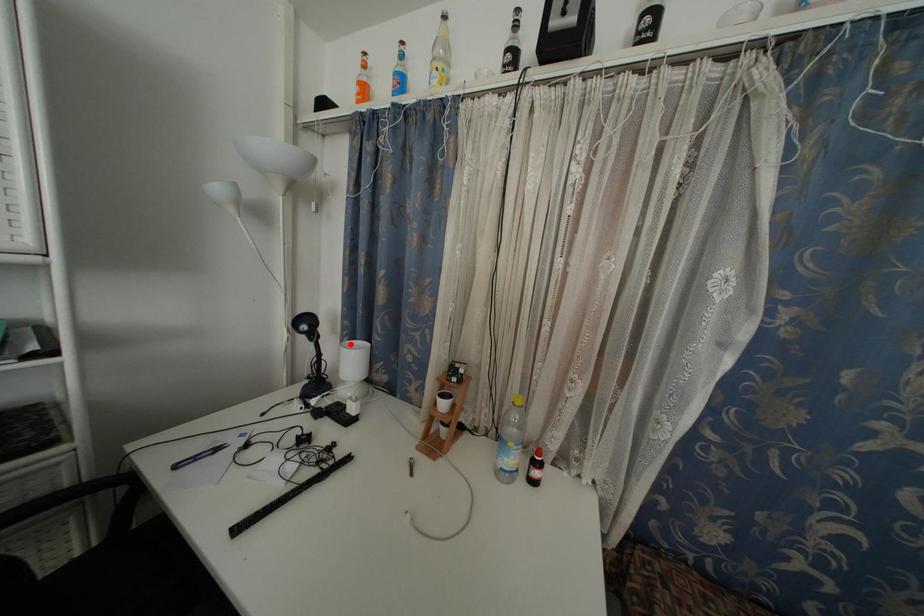
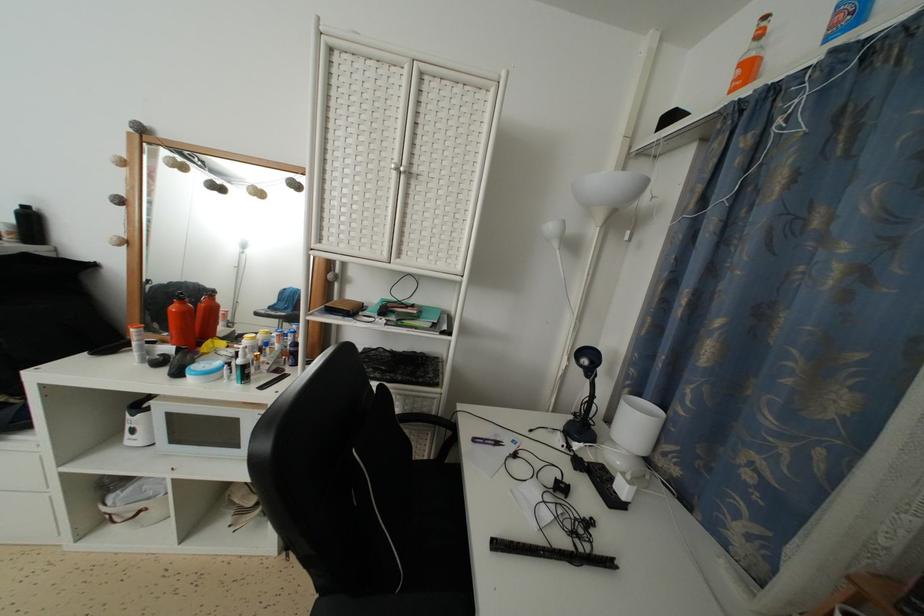
Where in the second image is the point corresponding to the highlighted location from the first image?

(630, 395)